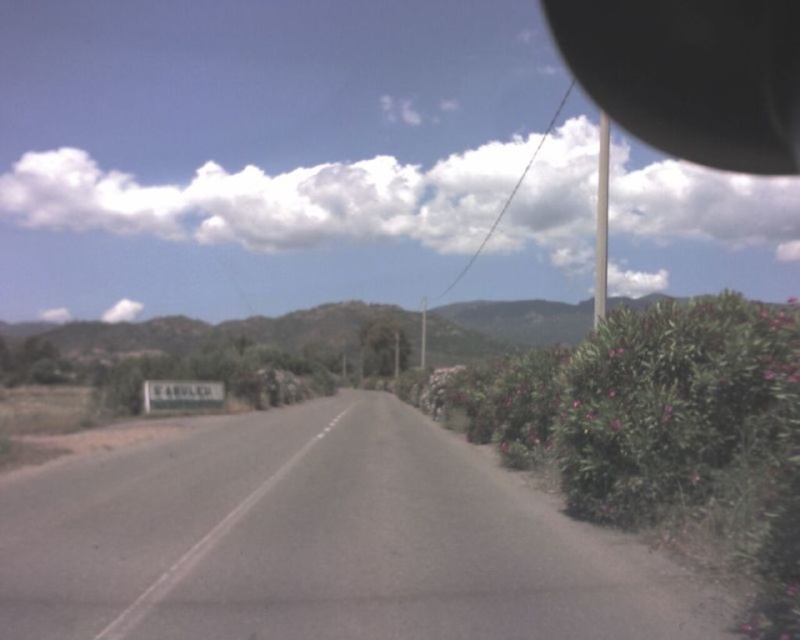
Between point (214, 458) and point (222, 406), which one is positioned behind?

Point (222, 406)

Who is higher up, asphalt road at center or gray metallic sign at center?

asphalt road at center

In order to click on asphalt road at center in this screenshot , I will do `click(322, 541)`.

Where is `asphalt road at center`? This screenshot has height=640, width=800. asphalt road at center is located at coordinates (322, 541).

Which of these two, black rubber view mirror at upper right or gray metallic sign at center, stands taller?

black rubber view mirror at upper right is taller.

Can you confirm if black rubber view mirror at upper right is positioned above gray metallic sign at center?

Yes.

Between point (786, 115) and point (189, 380), which one is positioned behind?

The point (786, 115) is more distant.

At what (x,y) coordinates should I click in order to perform the action: click on black rubber view mirror at upper right. Please return your answer as a coordinate pair (x, y). Looking at the image, I should click on (692, 74).

Does asphalt road at center have a smaller size compared to black rubber view mirror at upper right?

Correct, asphalt road at center occupies less space than black rubber view mirror at upper right.

Is asphalt road at center thinner than black rubber view mirror at upper right?

Correct, asphalt road at center's width is less than black rubber view mirror at upper right's.

Identify the location of asphalt road at center. (322, 541).

The height and width of the screenshot is (640, 800). What are the coordinates of `asphalt road at center` in the screenshot? It's located at 322,541.